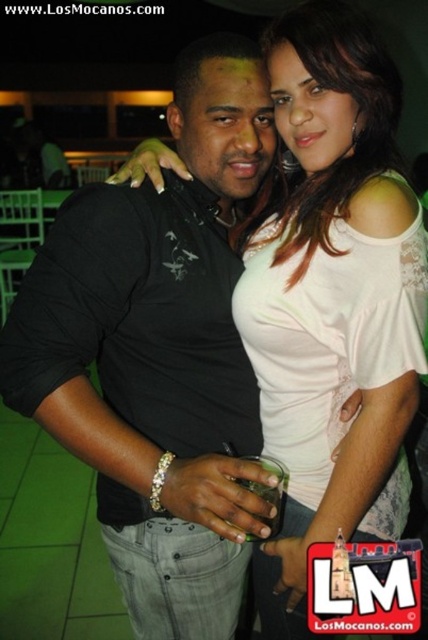
You are a photographer at a party. You need to position two subjects so that their outfits are visible. The subjects are wearing a black matte shirt at center and a white lace top at center. According to the scene, which subject should stand to the left to ensure their outfit is visible?

The black matte shirt at center should stand to the left because it is already positioned to the left of the white lace top at center in the image.

You are a photographer trying to adjust the lighting for a portrait. You notice the black matte shirt at center and the white lace top at center. Which clothing item is closer to the camera?

The black matte shirt at center is positioned under the white lace top at center, so the white lace top at center is closer to the camera.